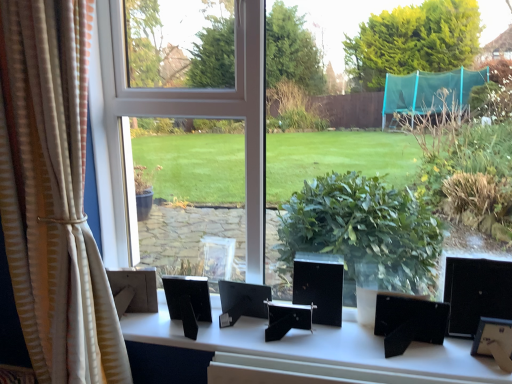
Question: Is beige striped curtain at left not inside black plastic picture frames at center?

Choices:
 (A) no
 (B) yes

Answer: (B)

Question: From a real-world perspective, is beige striped curtain at left under black plastic picture frames at center?

Choices:
 (A) yes
 (B) no

Answer: (B)

Question: Can you confirm if beige striped curtain at left is smaller than black plastic picture frames at center?

Choices:
 (A) no
 (B) yes

Answer: (A)

Question: Is beige striped curtain at left behind black plastic picture frames at center?

Choices:
 (A) no
 (B) yes

Answer: (A)

Question: Does beige striped curtain at left have a lesser width compared to black plastic picture frames at center?

Choices:
 (A) no
 (B) yes

Answer: (B)

Question: Considering their positions, is transparent glass window at center located in front of or behind beige striped curtain at left?

Choices:
 (A) behind
 (B) front

Answer: (A)

Question: Which is correct: transparent glass window at center is inside beige striped curtain at left, or outside of it?

Choices:
 (A) inside
 (B) outside

Answer: (B)

Question: Does point (226, 153) appear closer or farther from the camera than point (62, 258)?

Choices:
 (A) closer
 (B) farther

Answer: (B)

Question: Considering the positions of transparent glass window at center and beige striped curtain at left in the image, is transparent glass window at center taller or shorter than beige striped curtain at left?

Choices:
 (A) tall
 (B) short

Answer: (B)

Question: Would you say beige striped curtain at left is inside or outside black plastic picture frames at center?

Choices:
 (A) inside
 (B) outside

Answer: (B)

Question: Considering their positions, is beige striped curtain at left located in front of or behind black plastic picture frames at center?

Choices:
 (A) front
 (B) behind

Answer: (A)

Question: From the image's perspective, is beige striped curtain at left above or below black plastic picture frames at center?

Choices:
 (A) below
 (B) above

Answer: (B)

Question: Is beige striped curtain at left wider or thinner than black plastic picture frames at center?

Choices:
 (A) thin
 (B) wide

Answer: (A)

Question: From the image's perspective, is black plastic picture frames at center positioned above or below beige striped curtain at left?

Choices:
 (A) below
 (B) above

Answer: (A)

Question: Is black plastic picture frames at center in front of or behind beige striped curtain at left in the image?

Choices:
 (A) front
 (B) behind

Answer: (B)